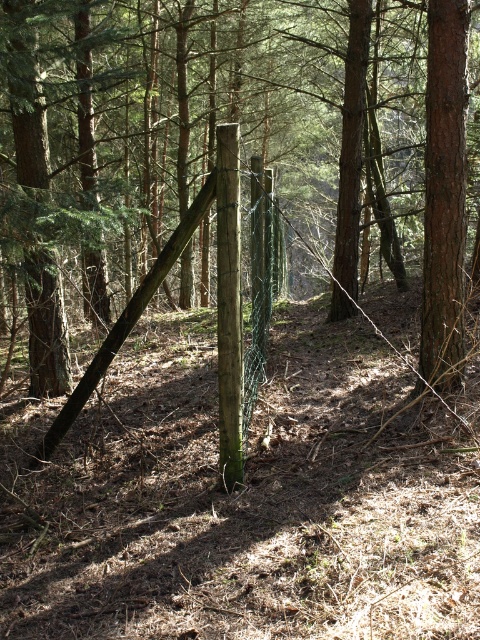
Who is more forward, [437,212] or [93,388]?

Point [93,388]

Who is lower down, smooth brown tree trunk at right or green wire mesh fence at center?

Positioned lower is green wire mesh fence at center.

The height and width of the screenshot is (640, 480). I want to click on smooth brown tree trunk at right, so click(444, 193).

At what (x,y) coordinates should I click in order to perform the action: click on smooth brown tree trunk at right. Please return your answer as a coordinate pair (x, y). This screenshot has height=640, width=480. Looking at the image, I should click on (444, 193).

Is smooth brown tree trunk at right above smooth brown wooden post at center?

Indeed, smooth brown tree trunk at right is positioned over smooth brown wooden post at center.

The image size is (480, 640). What do you see at coordinates (444, 193) in the screenshot? I see `smooth brown tree trunk at right` at bounding box center [444, 193].

Who is more forward, (x=445, y=29) or (x=232, y=321)?

Positioned in front is point (x=232, y=321).

The width and height of the screenshot is (480, 640). What are the coordinates of `smooth brown tree trunk at right` in the screenshot? It's located at (444, 193).

Is green wire mesh fence at center shorter than smooth brown wooden post at center?

Incorrect, green wire mesh fence at center's height does not fall short of smooth brown wooden post at center's.

Who is more distant from viewer, (x=238, y=419) or (x=235, y=410)?

The point (x=238, y=419) is more distant.

The image size is (480, 640). I want to click on green wire mesh fence at center, so click(x=217, y=310).